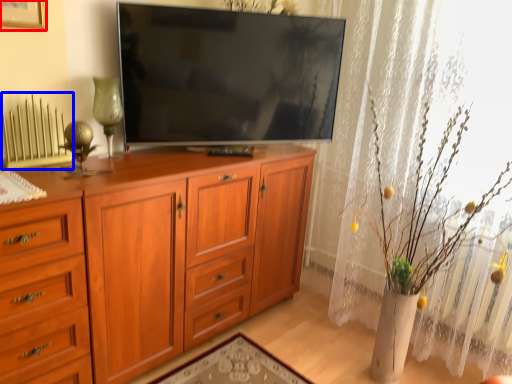
Question: Which object appears closest to the camera in this image, picture frame (highlighted by a red box) or radiator (highlighted by a blue box)?

Choices:
 (A) picture frame
 (B) radiator

Answer: (A)